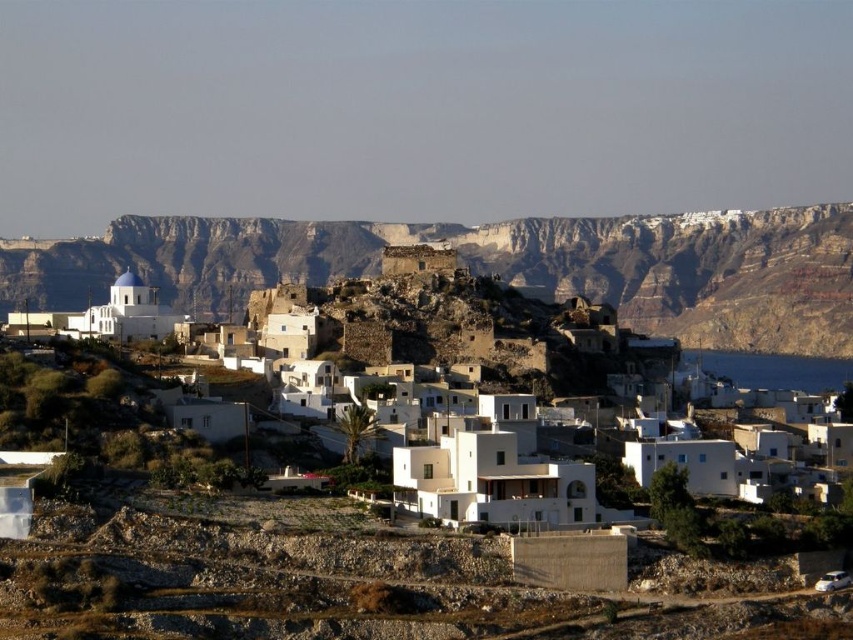
You are a photographer planning to capture the rugged stone cliff at center and the blue water at lower right in a single frame. Based on the scene description, which object will occupy more of the image area?

The rugged stone cliff at center is larger in size than the blue water at lower right, so it will occupy more of the image area.

You are standing in the coastal village and want to take a photo of the rugged stone cliff at center. Where should you position yourself to capture it in the frame?

To capture the rugged stone cliff at center in your photo, position yourself directly in front of it since its 2D coordinates are at the center point of the image.